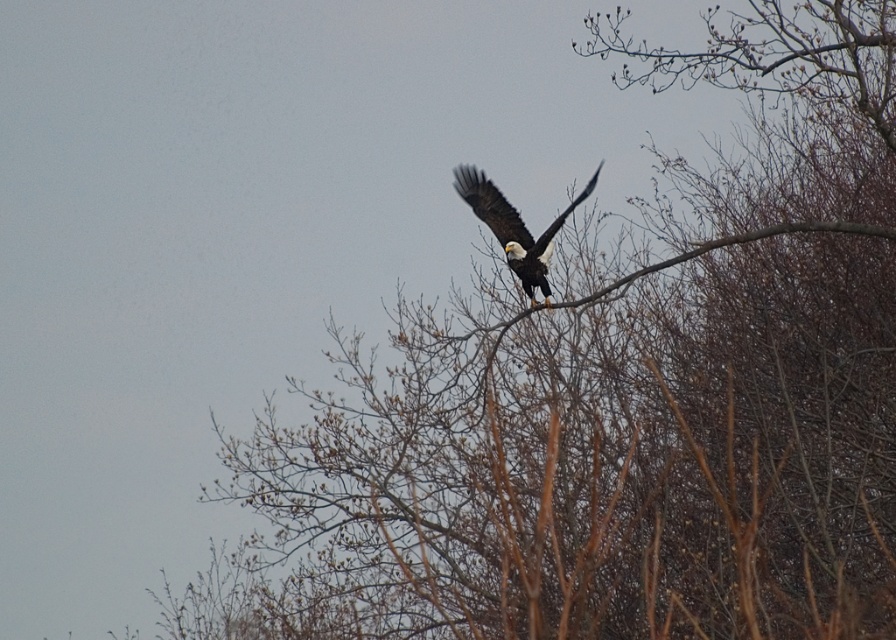
You are a photographer trying to capture the bald eagle in the center of the image. You notice a point at coordinates (514, 227). Based on the scene, what does this point likely represent?

The point at coordinates (514, 227) corresponds to the white feathered bald eagle at center, which is the main subject of the image.